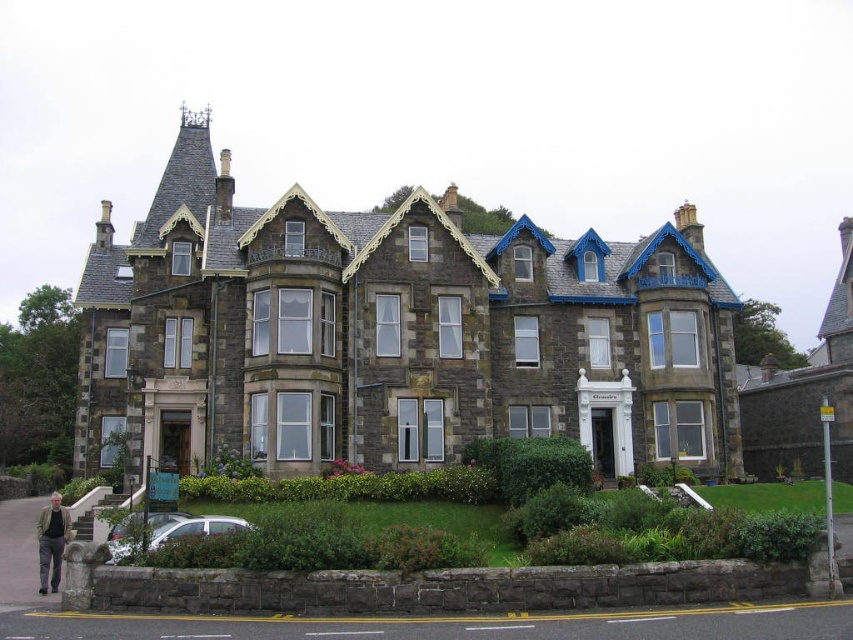
Question: Does dark gray stone mansion at upper right appear on the left side of light brown leather jacket at lower left?

Choices:
 (A) yes
 (B) no

Answer: (B)

Question: Which point is closer to the camera?

Choices:
 (A) silver metallic car at lower left
 (B) dark gray stone mansion at upper right

Answer: (A)

Question: Which of these objects is positioned farthest from the silver metallic car at lower left?

Choices:
 (A) dark gray stone mansion at upper right
 (B) stone mansion at center
 (C) light brown leather jacket at lower left

Answer: (A)

Question: Estimate the real-world distances between objects in this image. Which object is farther from the stone mansion at center?

Choices:
 (A) light brown leather jacket at lower left
 (B) dark gray stone mansion at upper right
 (C) silver metallic car at lower left

Answer: (B)

Question: From the image, what is the correct spatial relationship of stone mansion at center in relation to light brown leather jacket at lower left?

Choices:
 (A) below
 (B) above

Answer: (B)

Question: Does silver metallic car at lower left have a smaller size compared to light brown leather jacket at lower left?

Choices:
 (A) yes
 (B) no

Answer: (A)